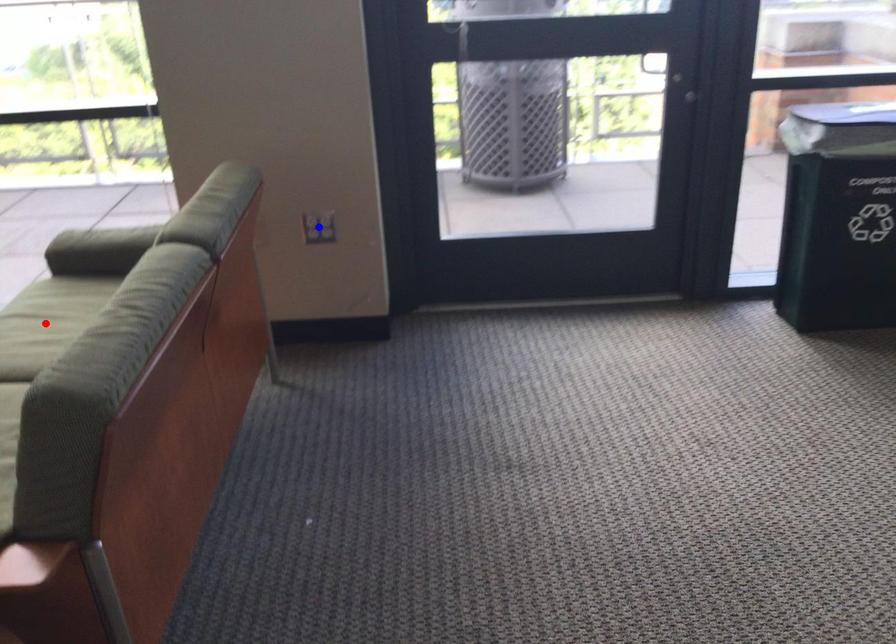
Question: In the image, two points are highlighted. Which point is nearer to the camera? Reply with the corresponding letter.

Choices:
 (A) blue point
 (B) red point

Answer: (B)